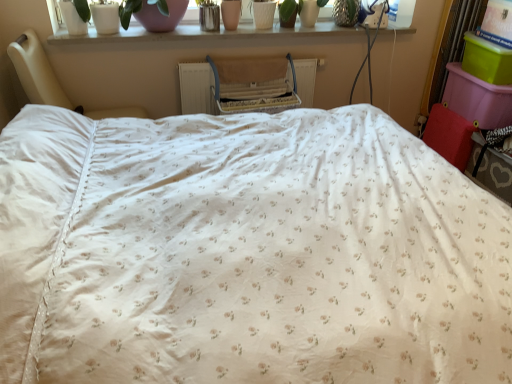
Question: From the image's perspective, is white fabric bed at left positioned above or below white painted wood at upper center?

Choices:
 (A) below
 (B) above

Answer: (A)

Question: Is white fabric bed at left taller or shorter than white painted wood at upper center?

Choices:
 (A) short
 (B) tall

Answer: (B)

Question: Which object is positioned farthest from the pink glass vase at upper center?

Choices:
 (A) white plastic window screen at upper right
 (B) white plastic radiator at center
 (C) white matte pot at upper center
 (D) white painted wood at upper center
 (E) white floral fabric bed at center

Answer: (E)

Question: Based on their relative distances, which object is nearer to the pink glass vase at upper center?

Choices:
 (A) white fabric bed at left
 (B) white plastic radiator at center
 (C) white plastic window screen at upper right
 (D) white painted wood at upper center
 (E) white matte pot at upper center

Answer: (D)